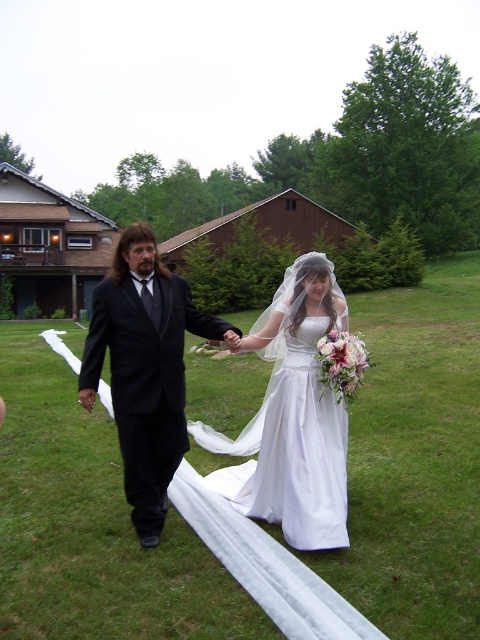
You are a photographer positioned at the center of the grassy lawn. You want to take a photo of the matte black suit at center. Where should you aim your camera to capture it in the frame?

You should aim your camera at the point with coordinates 0.578 in the x axis and 0.302 in the y axis to capture the matte black suit at center.

You are a photographer standing at the camera position. The white satin dress at center is your main subject. To ensure the dress is in focus, you need to adjust the focus distance. What is the exact distance you should set the focus to?

The white satin dress at center is 3.48 meters from camera, so you should set the focus distance to 3.48 meters to ensure it is in focus.

You are a photographer at the wedding and need to capture the bride in her white satin dress at center. The bride is currently standing at point (x=291, y=417). Where should you position yourself to ensure the bride is centered in your shot?

Position yourself directly in front of the point (x=291, y=417) where the white satin dress at center is located to center the bride in your shot.